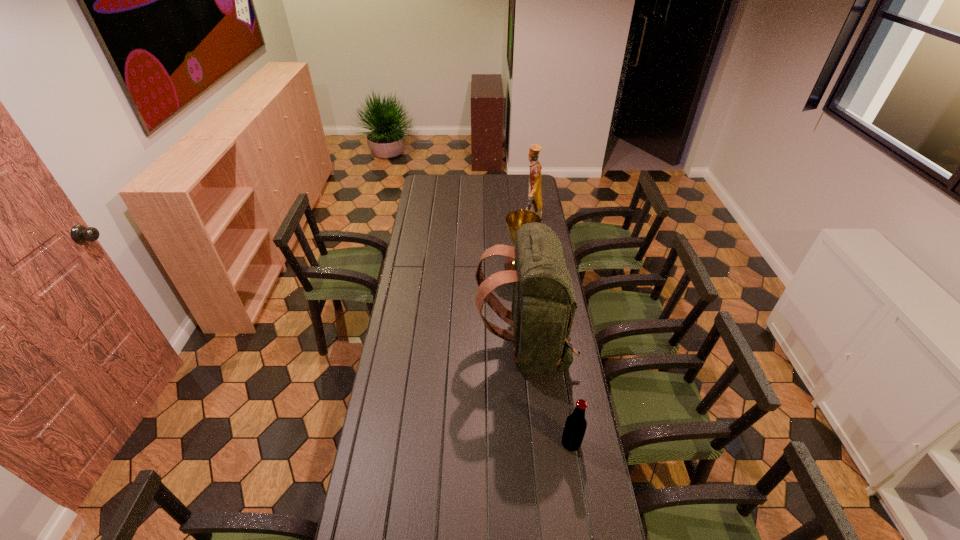
This screenshot has height=540, width=960. I want to click on vacant space that satisfies the following two spatial constraints: 1. on the plaque of the second shortest object; 2. on the back side of the nearest object, so click(x=537, y=443).